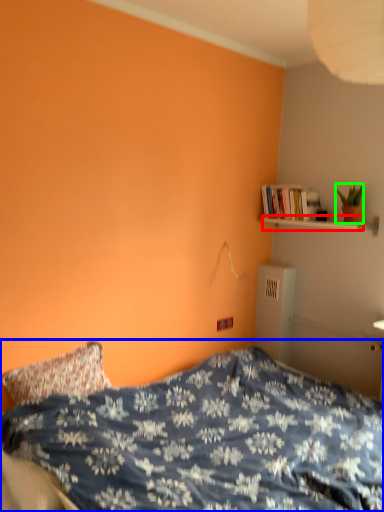
Question: Which object is the farthest from shelf (highlighted by a red box)? Choose among these: bed (highlighted by a blue box) or houseplant (highlighted by a green box).

Choices:
 (A) bed
 (B) houseplant

Answer: (A)